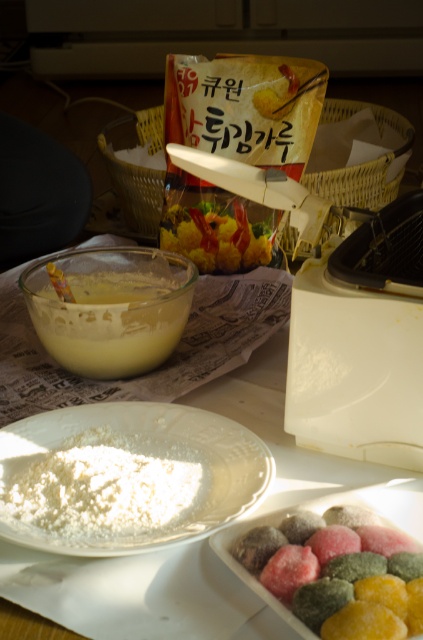
Between yellow matte bowl at center and glossy sugar-coated dumplings at bottom right, which one is positioned higher?

yellow matte bowl at center is above.

Is yellow matte bowl at center shorter than glossy sugar-coated dumplings at bottom right?

No.

This screenshot has height=640, width=423. Find the location of `yellow matte bowl at center`. yellow matte bowl at center is located at coordinates (109, 307).

The height and width of the screenshot is (640, 423). I want to click on yellow matte bowl at center, so click(109, 307).

What do you see at coordinates (140, 595) in the screenshot? Image resolution: width=423 pixels, height=640 pixels. I see `white matte plate at center` at bounding box center [140, 595].

Can you confirm if white matte plate at center is positioned above white powdery at center?

Indeed, white matte plate at center is positioned over white powdery at center.

Does point (22, 550) lie in front of point (90, 531)?

Yes.

Where is `white matte plate at center`? The height and width of the screenshot is (640, 423). white matte plate at center is located at coordinates (140, 595).

Is white powdery at center shorter than shiny plastic container at center?

Yes, white powdery at center is shorter than shiny plastic container at center.

Can you confirm if white powdery at center is thinner than shiny plastic container at center?

Indeed, white powdery at center has a lesser width compared to shiny plastic container at center.

Locate an element on the screen. white powdery at center is located at coordinates (106, 490).

Where is `white powdery at center`? The width and height of the screenshot is (423, 640). white powdery at center is located at coordinates (106, 490).